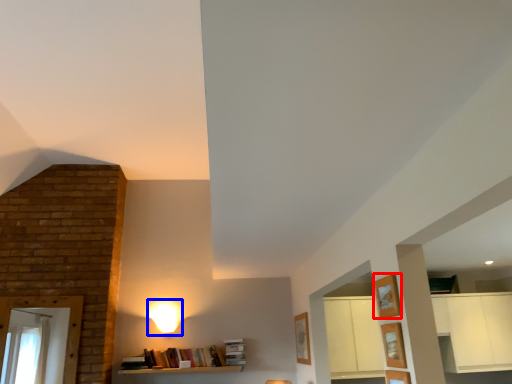
Question: Which point is closer to the camera, shelf (highlighted by a red box) or lamp (highlighted by a blue box)?

Choices:
 (A) shelf
 (B) lamp

Answer: (A)